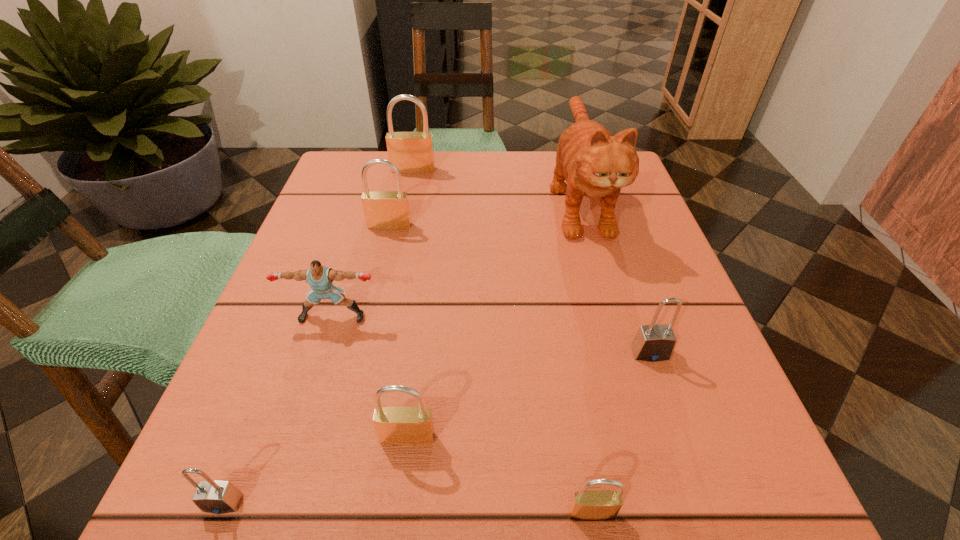
Where is `the third biggest brass padlock`? the third biggest brass padlock is located at coordinates (401, 426).

Where is `the third nearest padlock`? The image size is (960, 540). the third nearest padlock is located at coordinates coord(401,426).

Locate an element on the screen. the nearer gray padlock is located at coordinates (218, 497).

The width and height of the screenshot is (960, 540). Identify the location of the leftmost padlock. (218, 497).

This screenshot has width=960, height=540. I want to click on the rightmost brass padlock, so click(586, 504).

Identify the location of the nearest brass padlock. Image resolution: width=960 pixels, height=540 pixels. (586, 504).

Where is `free space located on the face of the orange cat`? The width and height of the screenshot is (960, 540). free space located on the face of the orange cat is located at coordinates (658, 477).

The image size is (960, 540). Find the location of `free space located on the front-facing side of the farthest brass padlock`. free space located on the front-facing side of the farthest brass padlock is located at coordinates (390, 279).

Locate an element on the screen. free space located 0.150m on the front-facing side of the third smallest brass padlock is located at coordinates (375, 282).

Locate an element on the screen. The height and width of the screenshot is (540, 960). vacant area situated 0.100m on the front-facing side of the fifth nearest object is located at coordinates (313, 378).